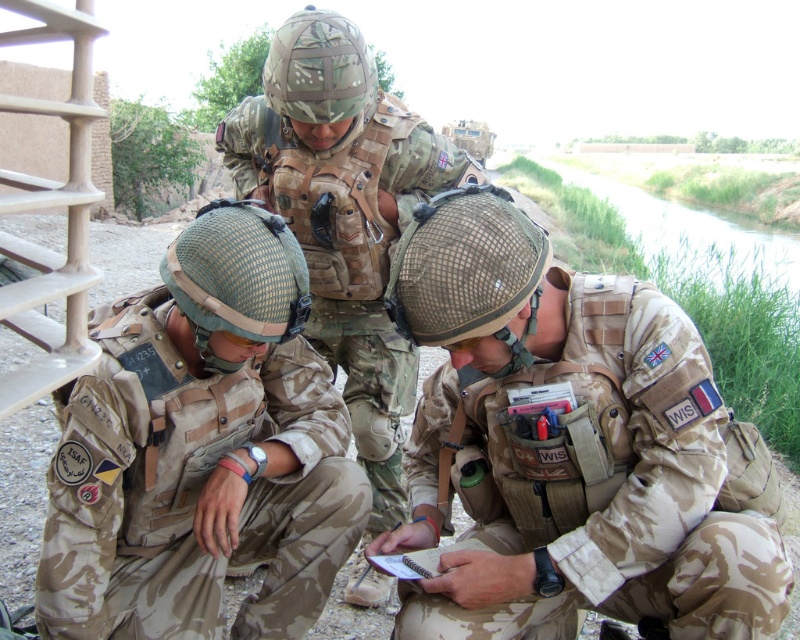
Question: Which object is closer to the camera taking this photo?

Choices:
 (A) camo fabric helmet at center
 (B) camouflage fabric uniform at lower left
 (C) camouflage fabric uniform at lower right

Answer: (C)

Question: Which point is farther to the camera?

Choices:
 (A) camouflage fabric uniform at lower left
 (B) camo fabric helmet at center

Answer: (B)

Question: Can you confirm if camouflage fabric uniform at lower right is smaller than camouflage fabric uniform at lower left?

Choices:
 (A) yes
 (B) no

Answer: (B)

Question: Can you confirm if camouflage fabric uniform at lower left is positioned to the left of camo fabric helmet at center?

Choices:
 (A) yes
 (B) no

Answer: (A)

Question: Is camouflage fabric uniform at lower right further to camera compared to camouflage fabric uniform at lower left?

Choices:
 (A) no
 (B) yes

Answer: (A)

Question: Considering the real-world distances, which object is closest to the camouflage fabric uniform at lower right?

Choices:
 (A) camouflage fabric uniform at lower left
 (B) camo fabric helmet at center

Answer: (A)